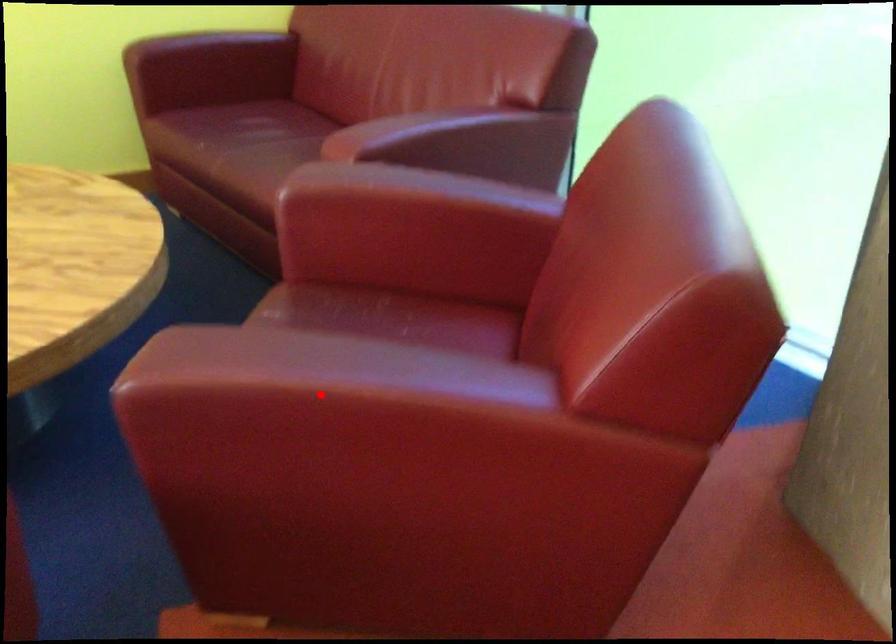
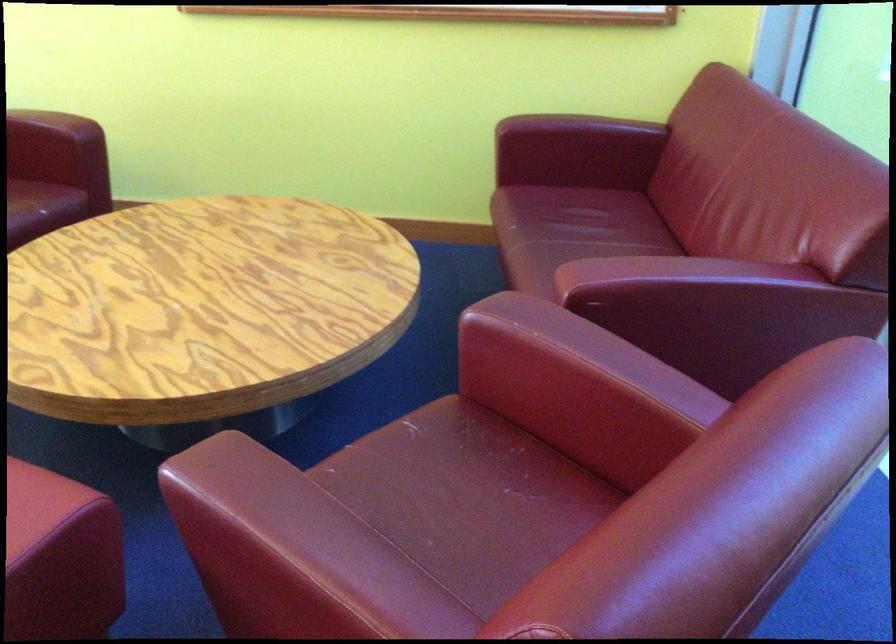
The point at the highlighted location is marked in the first image. Where is the corresponding point in the second image?

(261, 542)